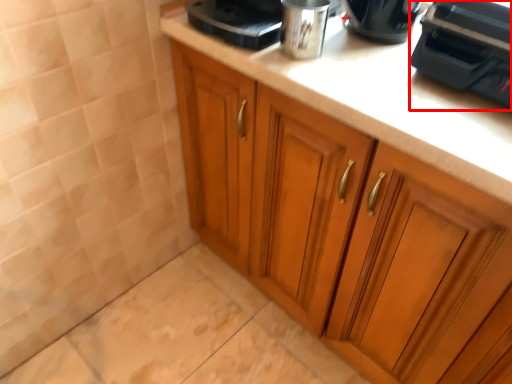
Question: From the image's perspective, where is home appliance (annotated by the red box) located in relation to cabinetry in the image?

Choices:
 (A) above
 (B) below

Answer: (A)